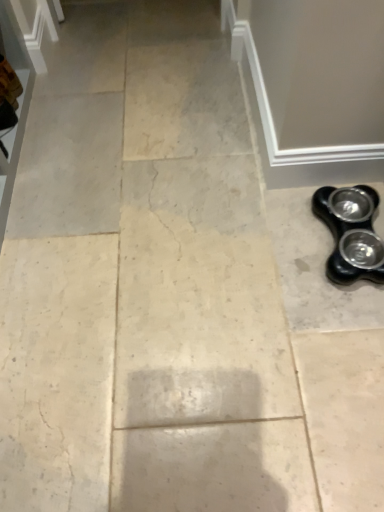
The image size is (384, 512). Describe the element at coordinates (350, 233) in the screenshot. I see `black rubber dog bowls at lower right` at that location.

Where is `black rubber dog bowls at lower right`? Image resolution: width=384 pixels, height=512 pixels. black rubber dog bowls at lower right is located at coordinates (350, 233).

Find the location of a particular element. The width and height of the screenshot is (384, 512). black rubber dog bowls at lower right is located at coordinates (350, 233).